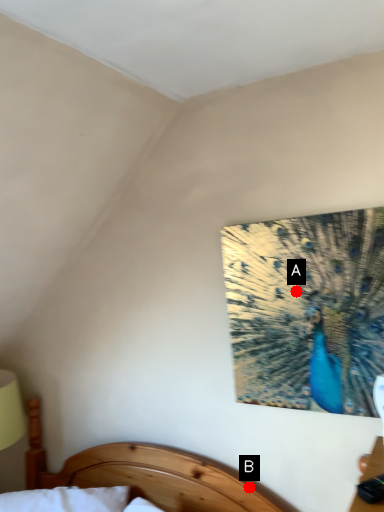
Question: Two points are circled on the image, labeled by A and B beside each circle. Which of the following is the farthest from the observer?

Choices:
 (A) A is further
 (B) B is further

Answer: (B)